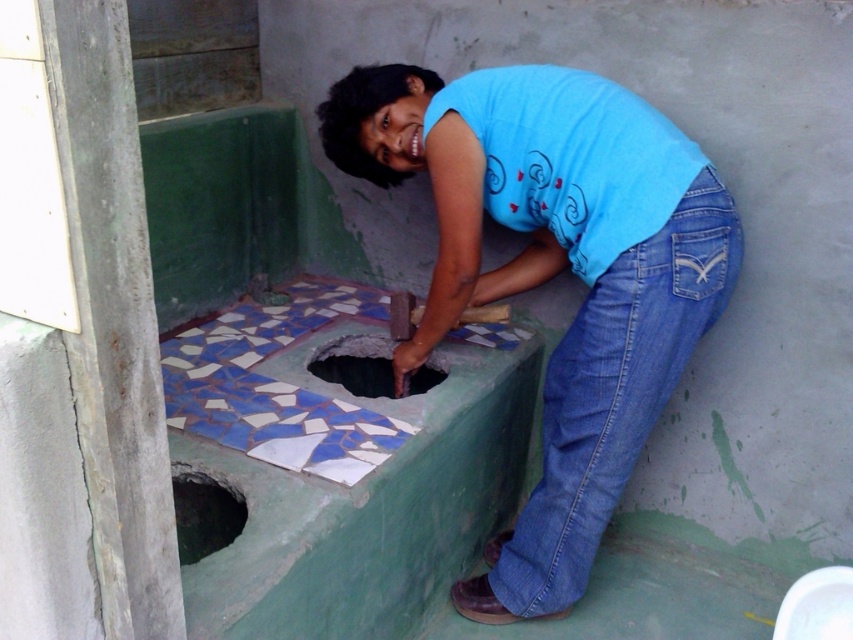
You are a construction worker who needs to inspect both the dark gray concrete hole at lower left and the smooth concrete hole at center. Which hole should you check first if you want to start with the one that is nearest to you?

You should check the dark gray concrete hole at lower left first because it is closer to the viewer than the smooth concrete hole at center.

You are a safety inspector observing the worker in the scene. The blue cotton shirt at center and denim at lower right are part of their clothing. Based on the spatial arrangement, which clothing item is covering the other?

The blue cotton shirt at center is positioned over denim at lower right, meaning the shirt is covering the denim.